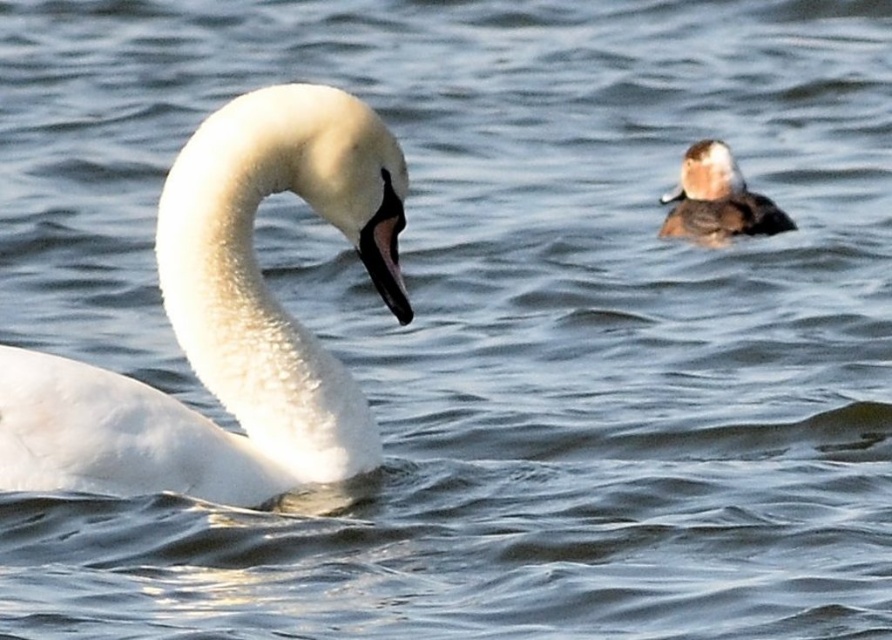
You are a photographer trying to capture the white matte swan at left and the black glossy beak at center in a single shot. Can you ensure both are in focus simultaneously?

The white matte swan at left is in front of the black glossy beak at center, so if you focus on the swan, the beak may appear slightly out of focus depending on the camera settings. Adjust the aperture for a deeper depth of field to include both in focus.

From the picture: You are a photographer trying to capture the white matte swan at left and the black glossy beak at center in a single shot. Based on their positions, which object is closer to the camera?

The white matte swan at left is positioned under the black glossy beak at center, meaning it is closer to the camera.